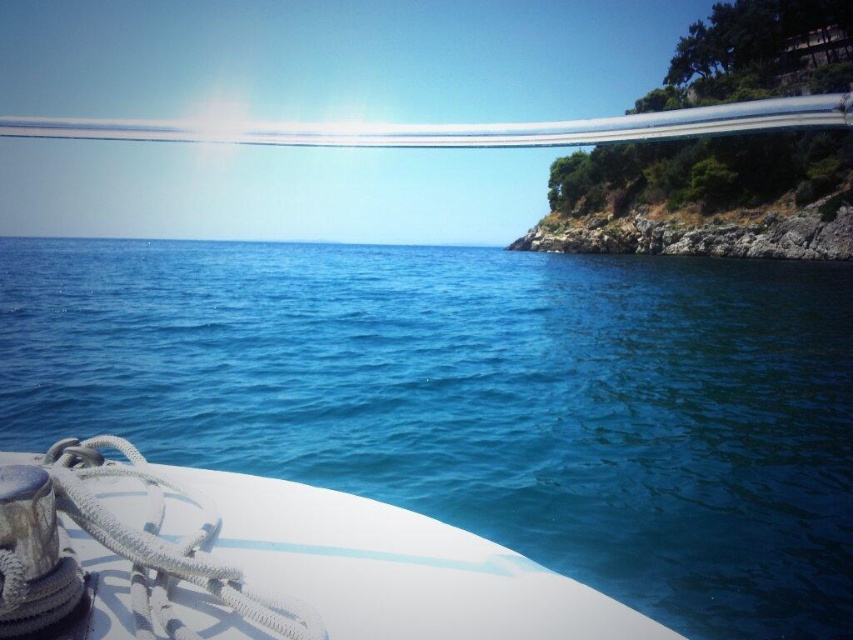
Question: Which point is closer to the camera taking this photo?

Choices:
 (A) (91, 520)
 (B) (726, 317)

Answer: (A)

Question: Is blue liquid water at center wider than white matte boat at lower left?

Choices:
 (A) no
 (B) yes

Answer: (B)

Question: From the image, what is the correct spatial relationship of blue liquid water at center in relation to white matte boat at lower left?

Choices:
 (A) right
 (B) left

Answer: (B)

Question: Does blue liquid water at center appear over white matte boat at lower left?

Choices:
 (A) yes
 (B) no

Answer: (A)

Question: Which object appears closest to the camera in this image?

Choices:
 (A) blue liquid water at center
 (B) white matte boat at lower left

Answer: (B)